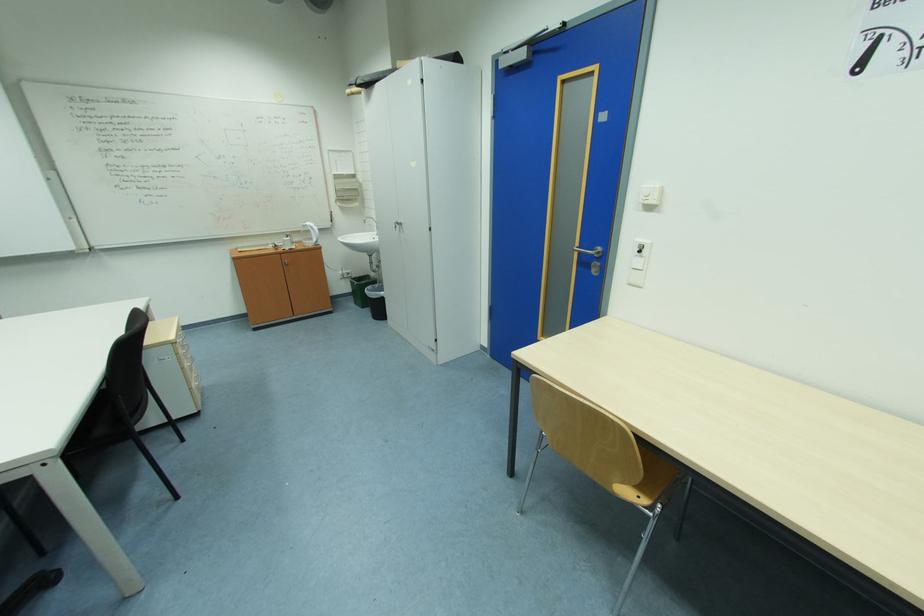
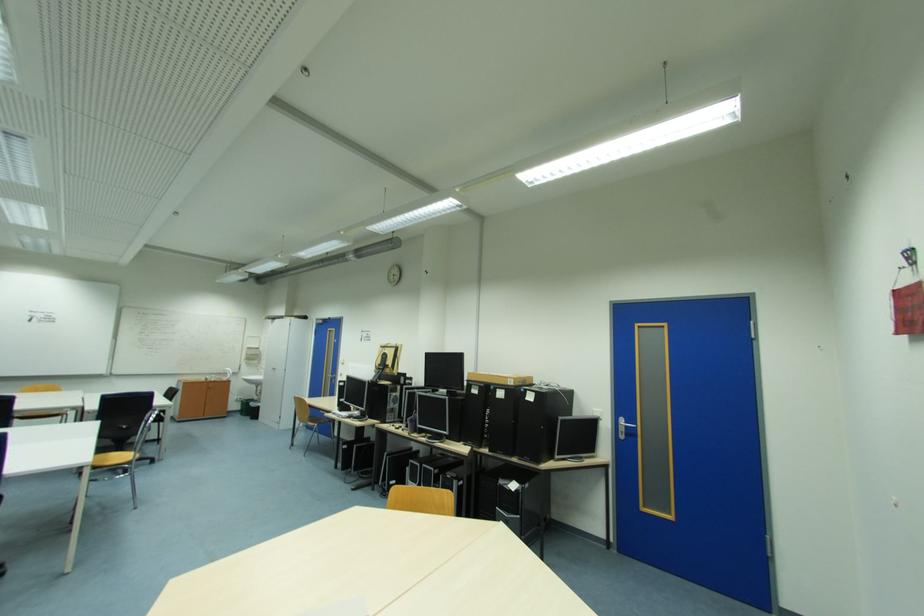
The point at (x=362, y=304) is marked in the first image. Where is the corresponding point in the second image?

(249, 416)